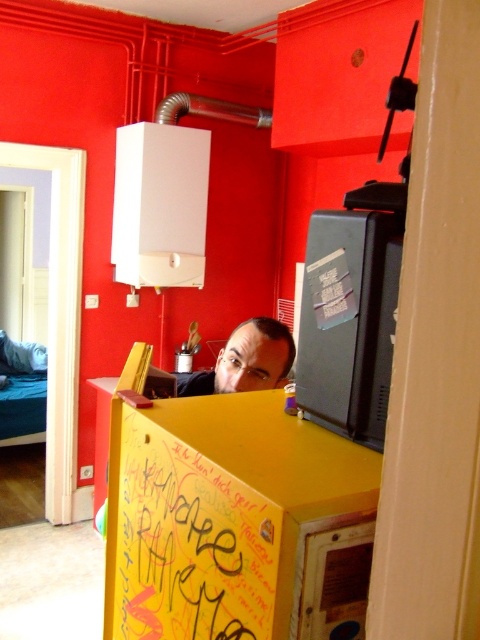
Question: Which object is the farthest from the yellow paperboard sign at center?

Choices:
 (A) yellow cardboard box at lower center
 (B) matte black monitor at upper right

Answer: (B)

Question: Which object is the farthest from the yellow cardboard box at lower center?

Choices:
 (A) yellow paperboard sign at center
 (B) matte black monitor at upper right

Answer: (B)

Question: Is yellow paperboard sign at center thinner than matte black monitor at upper right?

Choices:
 (A) yes
 (B) no

Answer: (B)

Question: Which of the following is the closest to the observer?

Choices:
 (A) (224, 593)
 (B) (200, 592)
 (C) (376, 308)

Answer: (A)

Question: Does yellow cardboard box at lower center lie in front of matte black monitor at upper right?

Choices:
 (A) no
 (B) yes

Answer: (B)

Question: Does yellow paperboard sign at center appear over matte black monitor at upper right?

Choices:
 (A) no
 (B) yes

Answer: (A)